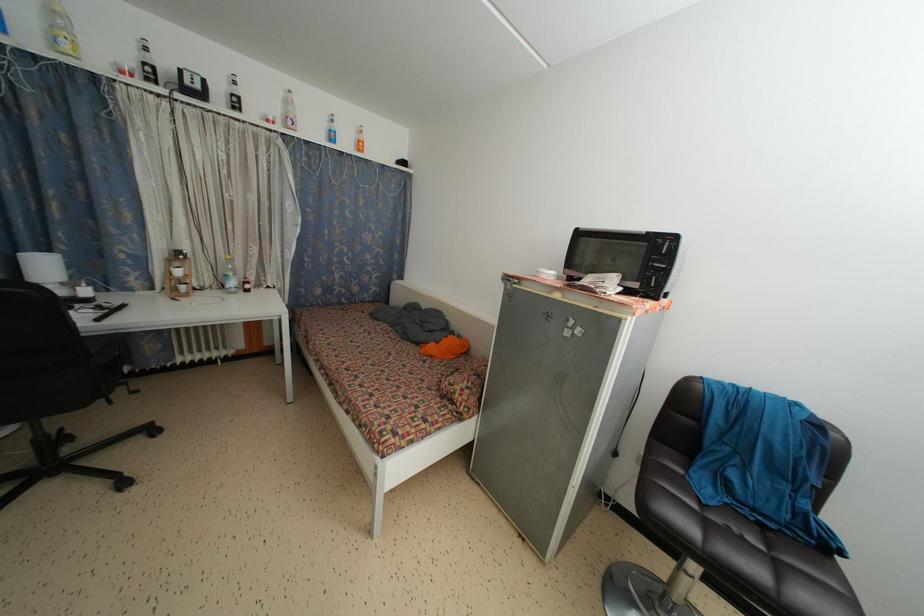
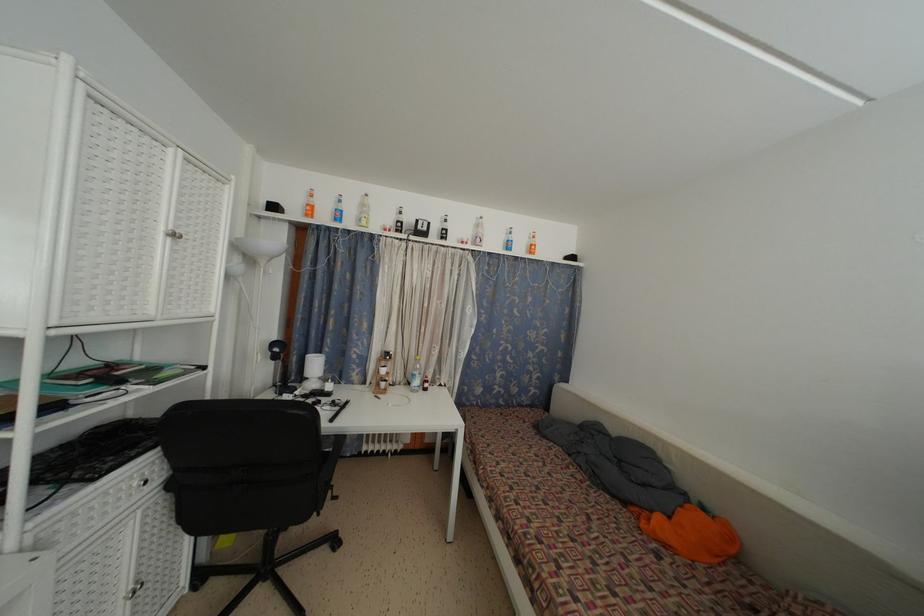
Locate, in the second image, the point that corresponds to point 237,100 in the first image.

(446, 235)